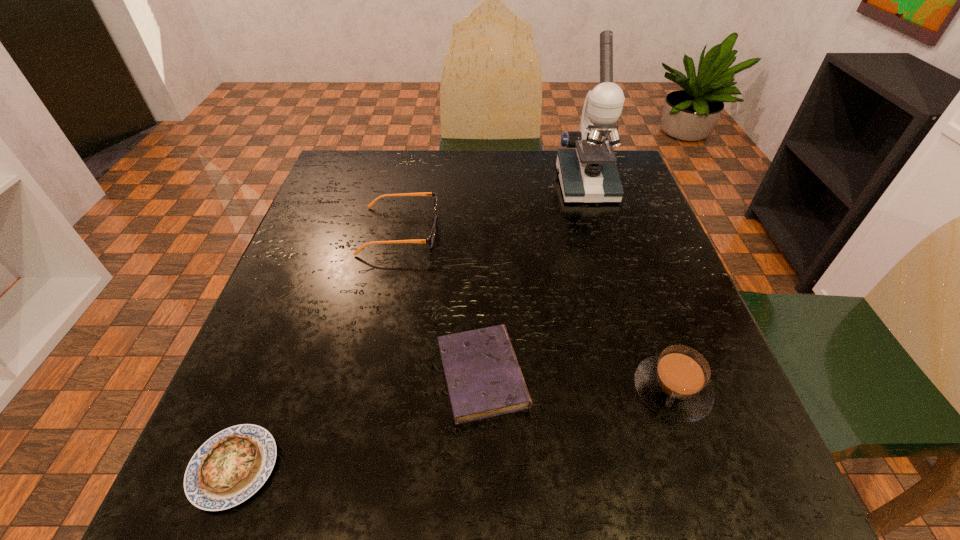
Where is `vacant space that satisfies the following two spatial constraints: 1. on the back side of the diary; 2. on the front-facing side of the spectacles`? The image size is (960, 540). vacant space that satisfies the following two spatial constraints: 1. on the back side of the diary; 2. on the front-facing side of the spectacles is located at coordinates (482, 231).

This screenshot has height=540, width=960. I want to click on blank area in the image that satisfies the following two spatial constraints: 1. at the eyepiece of the fourth shortest object; 2. on the left side of the microscope, so click(648, 390).

The image size is (960, 540). Identify the location of free space that satisfies the following two spatial constraints: 1. on the front-facing side of the third object from left to right; 2. on the right side of the second object from left to right. (371, 375).

The width and height of the screenshot is (960, 540). Find the location of `vacant space that satisfies the following two spatial constraints: 1. on the front-facing side of the diary; 2. on the right side of the spectacles`. vacant space that satisfies the following two spatial constraints: 1. on the front-facing side of the diary; 2. on the right side of the spectacles is located at coordinates (371, 375).